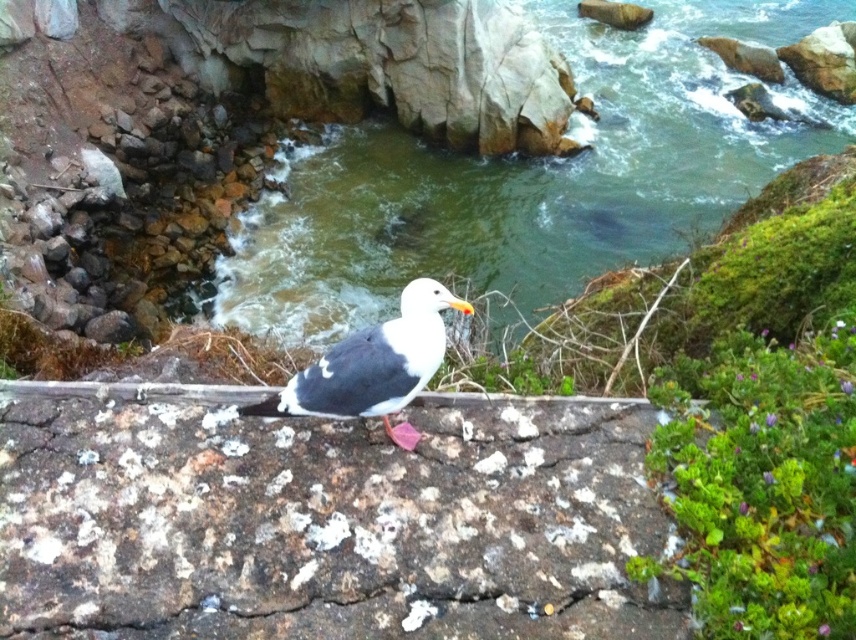
Does point (40, 509) come in front of point (256, 291)?

Yes, it is.

Between speckled rock at center and greenish water at center, which one is positioned lower?

speckled rock at center

Measure the distance between speckled rock at center and camera.

speckled rock at center is 2.47 meters from camera.

Where is `speckled rock at center`? The height and width of the screenshot is (640, 856). speckled rock at center is located at coordinates (324, 520).

Describe the element at coordinates (533, 179) in the screenshot. I see `greenish water at center` at that location.

Can you confirm if greenish water at center is wider than white matte bird at center?

Yes.

Between point (617, 77) and point (336, 342), which one is positioned in front?

Point (336, 342)

The height and width of the screenshot is (640, 856). In order to click on greenish water at center in this screenshot , I will do `click(533, 179)`.

Is point (593, 490) positioned in front of point (348, 364)?

No, it is behind (348, 364).

Is speckled rock at center to the left of white matte bird at center from the viewer's perspective?

Correct, you'll find speckled rock at center to the left of white matte bird at center.

Is point (384, 508) farther from camera compared to point (366, 328)?

No, (384, 508) is in front of (366, 328).

Where is `speckled rock at center`? speckled rock at center is located at coordinates (324, 520).